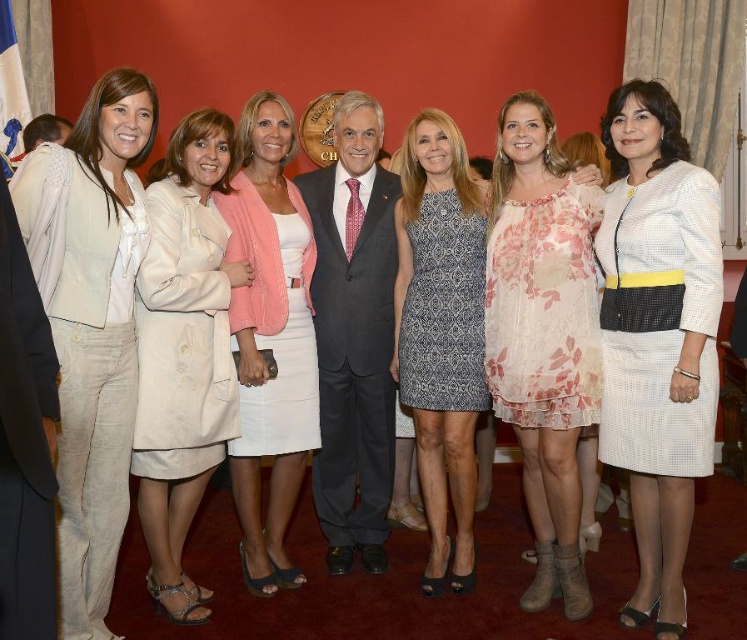
You are standing 10 feet away from the image. Is the point at coordinates point (x=406, y=266) closer to you than your current position?

The distance of point (x=406, y=266) from viewer is 11.19 feet, so the point is farther away than your current position of 10 feet.

You are standing in front of the group photo and want to locate the light beige linen pantsuit at left. According to the coordinates provided, where exactly is it positioned?

The light beige linen pantsuit at left is located at point 0.506 on the x axis and 0.123 on the y axis.